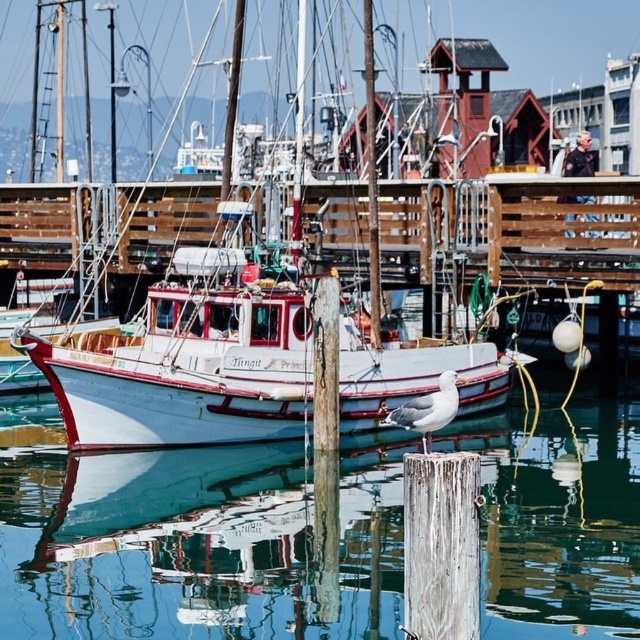
You are a photographer trying to capture both the white glossy boat at center and the white feathered seagull at center in a single shot. Given that your camera can only focus on objects within a 10 meter distance, can you fit both into your frame without moving closer?

The white glossy boat at center is bigger than the white feathered seagull at center, but since both are at the center of the frame, they are likely within the same focal plane. However, the camera can focus on objects within 10 meters, so as long as the distance to the boat and seagull is within that range, they can be captured together. The size difference doesn